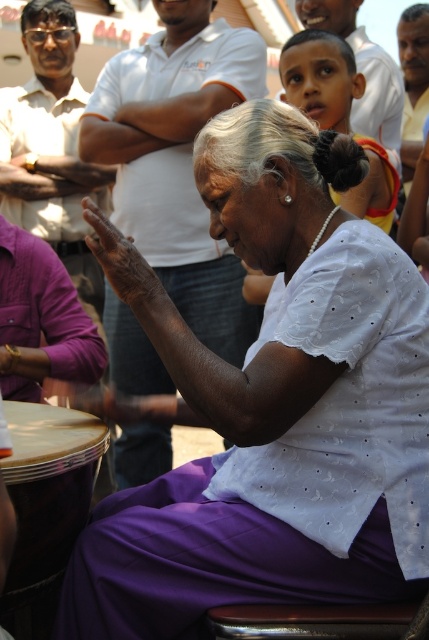
In the scene described, there is a point marked at coordinates (272, 404). What does this point indicate?

The point at (272, 404) indicates the location of the purple satin saree at center.